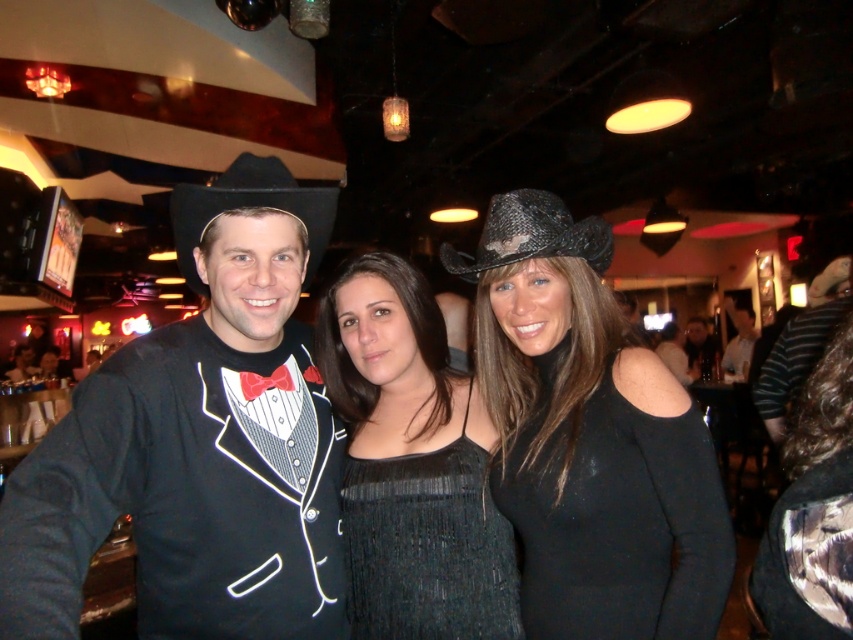
Which is behind, point (798, 538) or point (811, 289)?

The point (811, 289) is behind.

Who is shorter, black textured scarf at center or black textured hat at center?

black textured hat at center is shorter.

This screenshot has height=640, width=853. In order to click on black textured scarf at center in this screenshot , I will do `click(811, 512)`.

Find the location of `shiny black hat at center`. shiny black hat at center is located at coordinates [590, 440].

Does shiny black hat at center have a larger size compared to black striped shirt at center?

Incorrect, shiny black hat at center is not larger than black striped shirt at center.

Does point (521, 467) come in front of point (755, 388)?

Yes, point (521, 467) is closer to viewer.

In order to click on shiny black hat at center in this screenshot , I will do `click(590, 440)`.

Which of these two, black woven hat at center or black textured hat at center, stands taller?

Standing taller between the two is black textured hat at center.

Is black woven hat at center below black textured hat at center?

Yes, black woven hat at center is below black textured hat at center.

Between point (515, 208) and point (827, 262), which one is positioned in front?

Positioned in front is point (515, 208).

Locate an element on the screen. black woven hat at center is located at coordinates (531, 234).